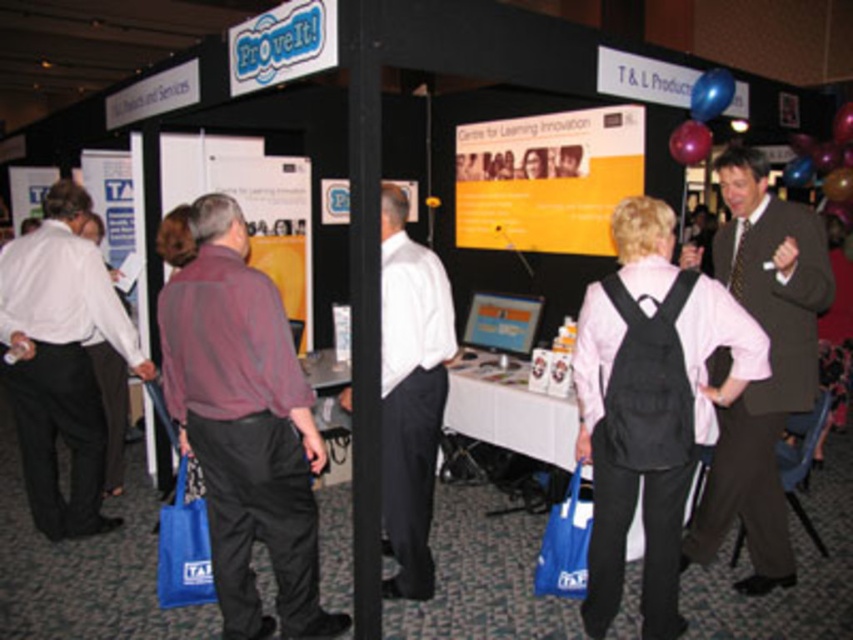
You are standing at the entrance of the event hall and want to take a photo of both the point at coordinates point (764, 576) and point (396, 440). Which point will appear larger in your photo?

Point (764, 576) is further to the camera than point (396, 440), so the point closer to the camera will appear larger in the photo. Therefore, point (396, 440) will appear larger in the photo.

You are standing in the center of the event hall and want to approach the dark brown suit at right. According to the coordinates provided, in which direction should you move to reach it?

The dark brown suit at right is located at point coordinates, so you should move to the right and slightly downward from your current position to reach it.